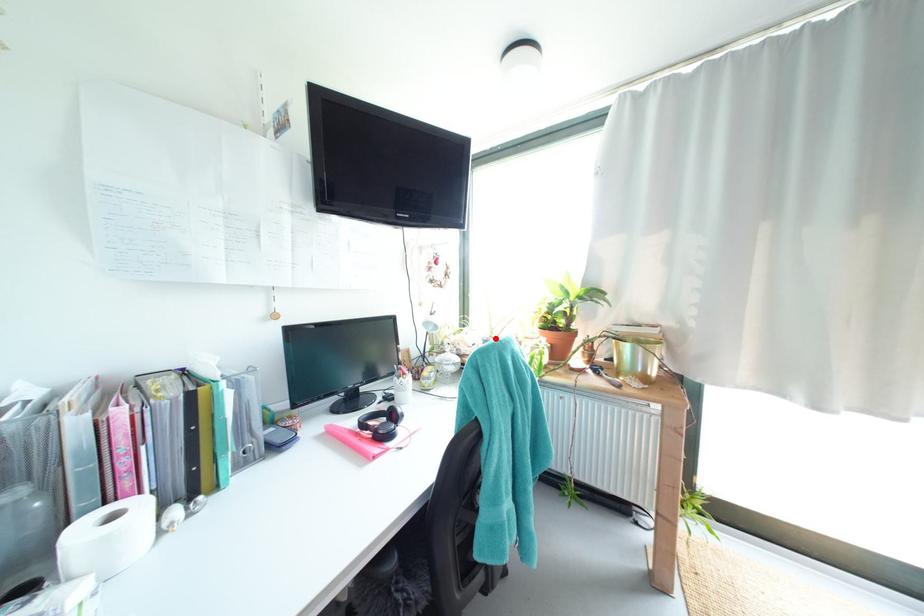
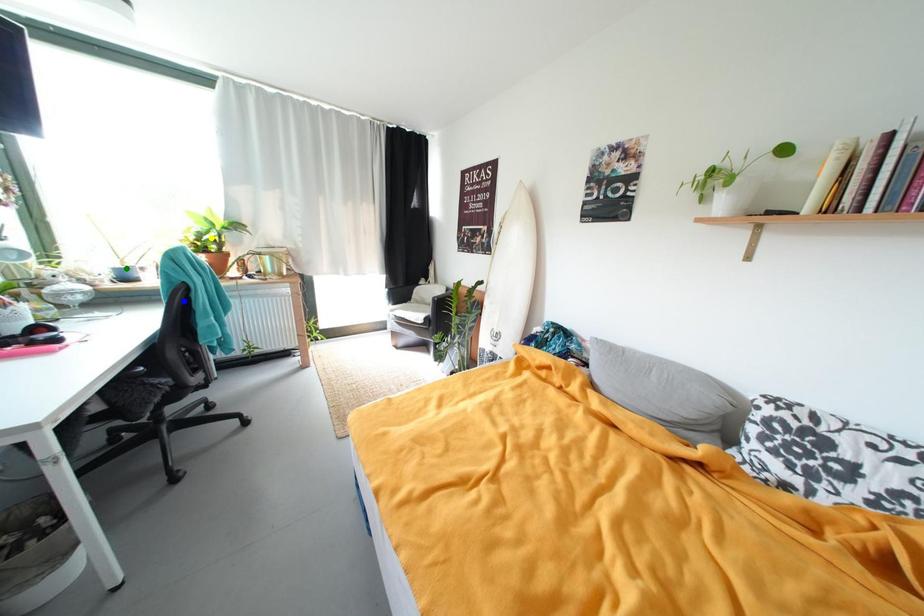
Question: I am providing you with two images of the same scene from different viewpoints. A red point is marked on the first image. You are given multiple points on the second image. Which point in image 2 represents the same 3d spot as the red point in image 1?

Choices:
 (A) blue point
 (B) yellow point
 (C) green point

Answer: (C)